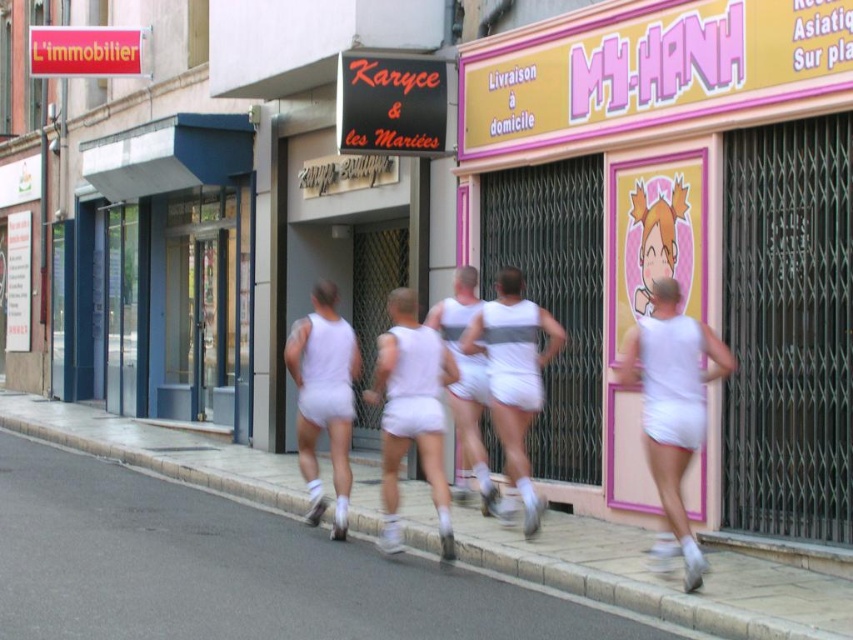
You are standing at the origin point of the image. Which of the two points, point (x=811, y=112) or point (x=193, y=625), is closer to you?

Point (x=193, y=625) is closer to you because it is in front of point (x=811, y=112).

You are a photographer standing at the camera position. You want to take a photo that includes both the point at coordinates point (444, 618) and point (693, 348). Since the first point is closer to you, will you need to adjust your focus to ensure both points are in focus?

Yes, you need to adjust your focus because point (444, 618) is closer to the camera than point (693, 348). To get both in focus, you should set the focus point between them or use a smaller aperture for a deeper depth of field.